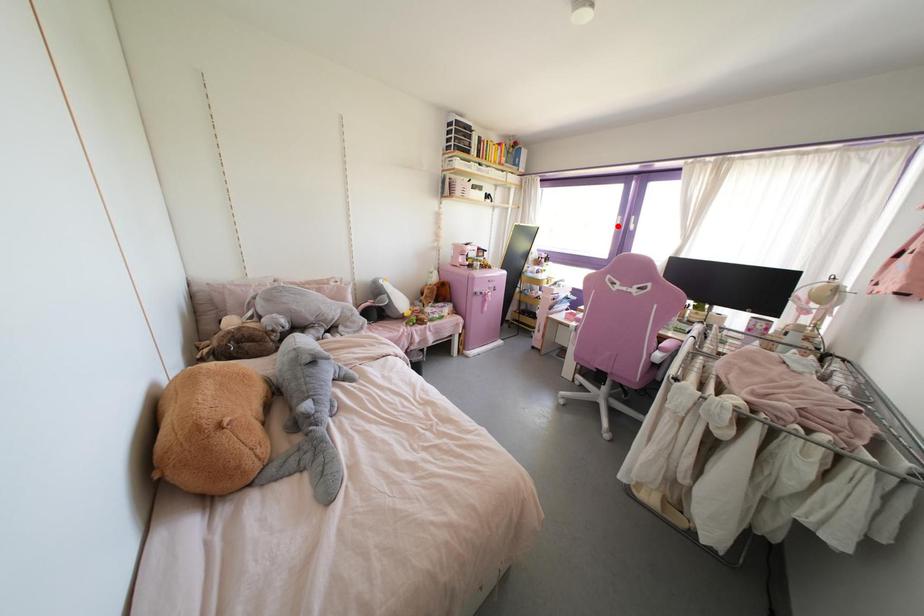
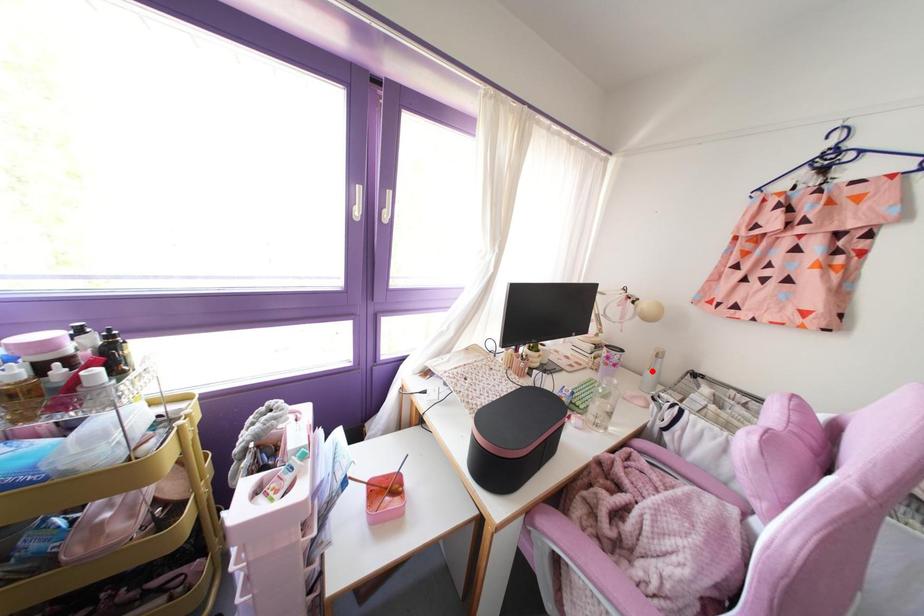
I am providing you with two images of the same scene from different viewpoints. A red point is marked on the first image and another point is marked on the second image. Do the highlighted points in image1 and image2 indicate the same real-world spot?

No